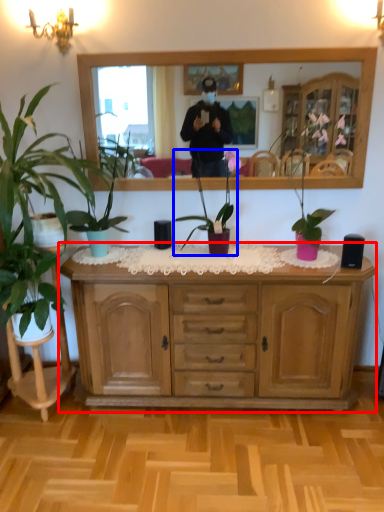
Question: Among these objects, which one is nearest to the camera, cabinetry (highlighted by a red box) or houseplant (highlighted by a blue box)?

Choices:
 (A) cabinetry
 (B) houseplant

Answer: (A)